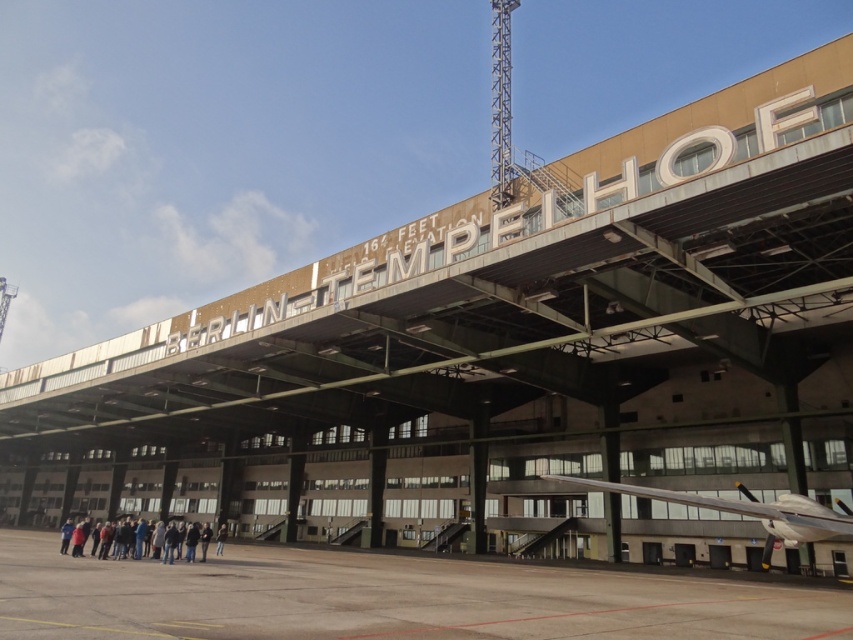
Describe the element at coordinates (386, 598) in the screenshot. I see `gray concrete tarmac at lower center` at that location.

Between gray concrete tarmac at lower center and white glossy airplane at lower right, which one appears on the left side from the viewer's perspective?

gray concrete tarmac at lower center is more to the left.

Find the location of a particular element. gray concrete tarmac at lower center is located at coordinates (386, 598).

Locate an element on the screen. Image resolution: width=853 pixels, height=640 pixels. gray concrete tarmac at lower center is located at coordinates (386, 598).

Can you confirm if gray concrete tarmac at lower center is taller than dark blue jeans at lower center?

Indeed, gray concrete tarmac at lower center has a greater height compared to dark blue jeans at lower center.

Between point (166, 573) and point (190, 531), which one is positioned in front?

Point (166, 573) is more forward.

Between point (277, 550) and point (187, 561), which one is positioned behind?

Point (277, 550)

Where is `gray concrete tarmac at lower center`? The image size is (853, 640). gray concrete tarmac at lower center is located at coordinates (386, 598).

You are a GUI agent. You are given a task and a screenshot of the screen. Output one action in this format:
    pyautogui.click(x=<x>, y=<y>)
    Task: Click on the white glossy airplane at lower right
    Image resolution: width=853 pixels, height=640 pixels.
    Given the screenshot: What is the action you would take?
    pyautogui.click(x=747, y=512)

What do you see at coordinates (747, 512) in the screenshot?
I see `white glossy airplane at lower right` at bounding box center [747, 512].

The image size is (853, 640). Find the location of `white glossy airplane at lower right`. white glossy airplane at lower right is located at coordinates (747, 512).